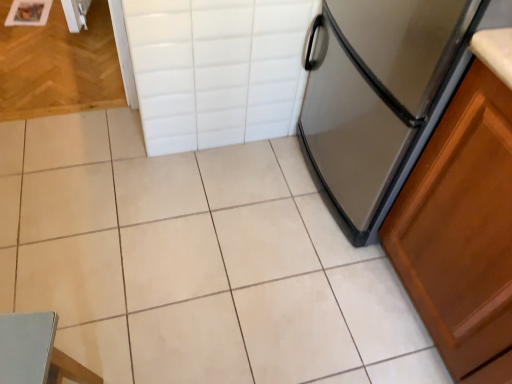
The height and width of the screenshot is (384, 512). Find the location of `unoccupied space behind light blue fabric chair at lower left`. unoccupied space behind light blue fabric chair at lower left is located at coordinates (90, 327).